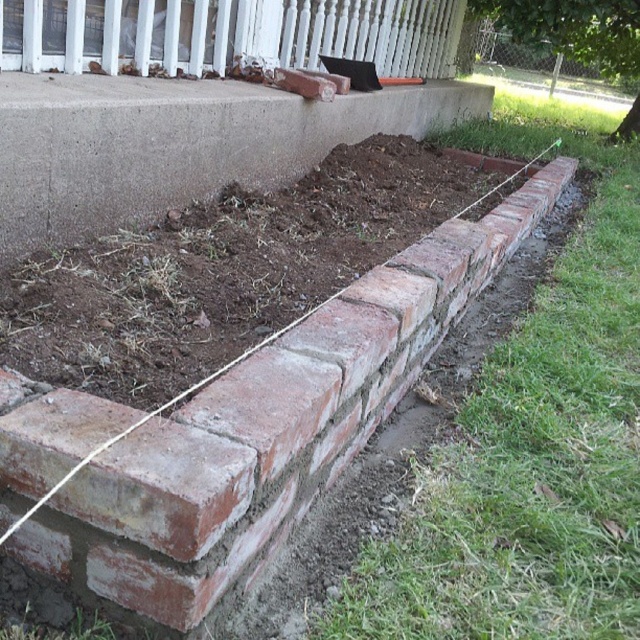
Question: Does red brick wall at lower right have a lesser width compared to smooth white porch at upper center?

Choices:
 (A) no
 (B) yes

Answer: (B)

Question: Which object is farther from the camera taking this photo?

Choices:
 (A) red brick wall at lower right
 (B) smooth white porch at upper center

Answer: (B)

Question: Which of the following is the farthest from the observer?

Choices:
 (A) click(362, 26)
 (B) click(541, 198)

Answer: (A)

Question: Is red brick wall at lower right smaller than smooth white porch at upper center?

Choices:
 (A) yes
 (B) no

Answer: (A)

Question: Can you confirm if red brick wall at lower right is positioned above smooth white porch at upper center?

Choices:
 (A) no
 (B) yes

Answer: (A)